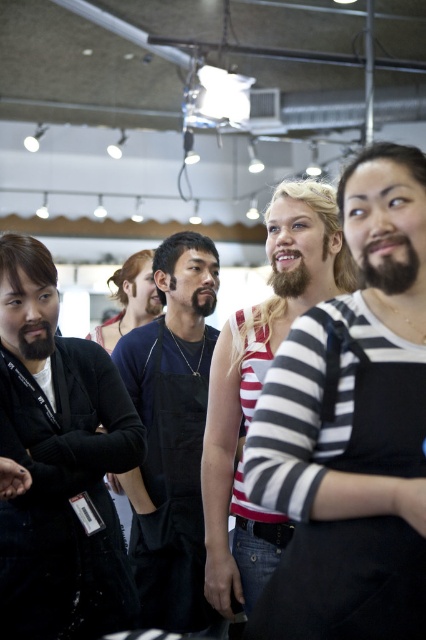
Looking at this image, is black matte jacket at left to the left of blondehairbeard at center from the viewer's perspective?

Yes, black matte jacket at left is to the left of blondehairbeard at center.

The width and height of the screenshot is (426, 640). I want to click on black matte jacket at left, so click(x=60, y=464).

What do you see at coordinates (60, 464) in the screenshot? I see `black matte jacket at left` at bounding box center [60, 464].

Locate an element on the screen. black matte jacket at left is located at coordinates (60, 464).

Between black matte apron at center and blondehairbeard at center, which one has more height?

With more height is black matte apron at center.

What are the coordinates of `black matte apron at center` in the screenshot? It's located at (172, 433).

Is point (80, 392) less distant than point (118, 474)?

Yes, it is in front of point (118, 474).

Based on the photo, who is more distant from viewer, (37, 429) or (173, 620)?

Positioned behind is point (173, 620).

Who is more forward, (x=26, y=371) or (x=189, y=456)?

Positioned in front is point (x=26, y=371).

What are the coordinates of `black matte jacket at left` in the screenshot? It's located at (60, 464).